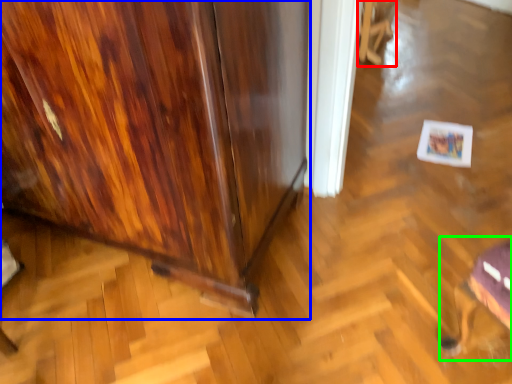
Question: Which is nearer to the swivel chair (highlighted by a red box)? furniture (highlighted by a blue box) or swivel chair (highlighted by a green box).

Choices:
 (A) furniture
 (B) swivel chair

Answer: (A)